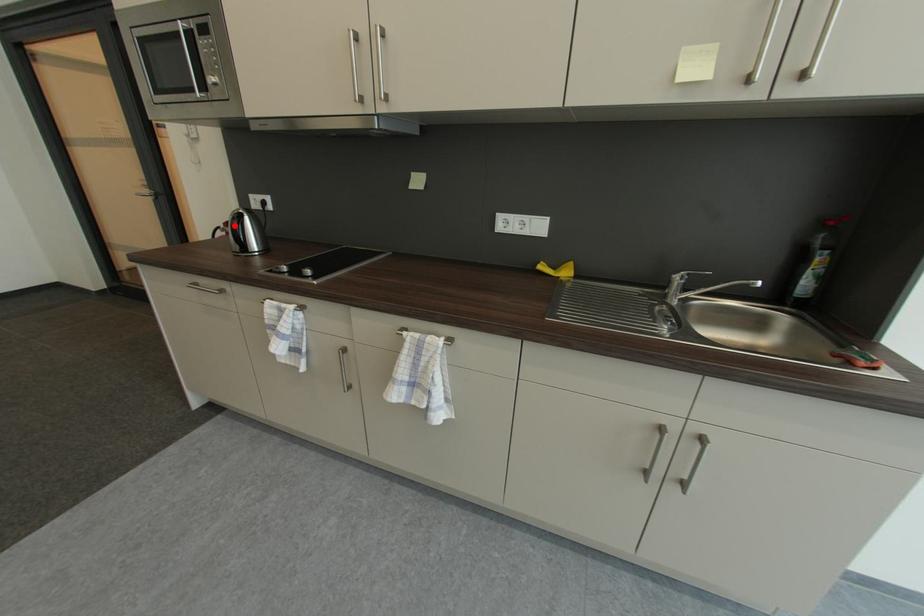
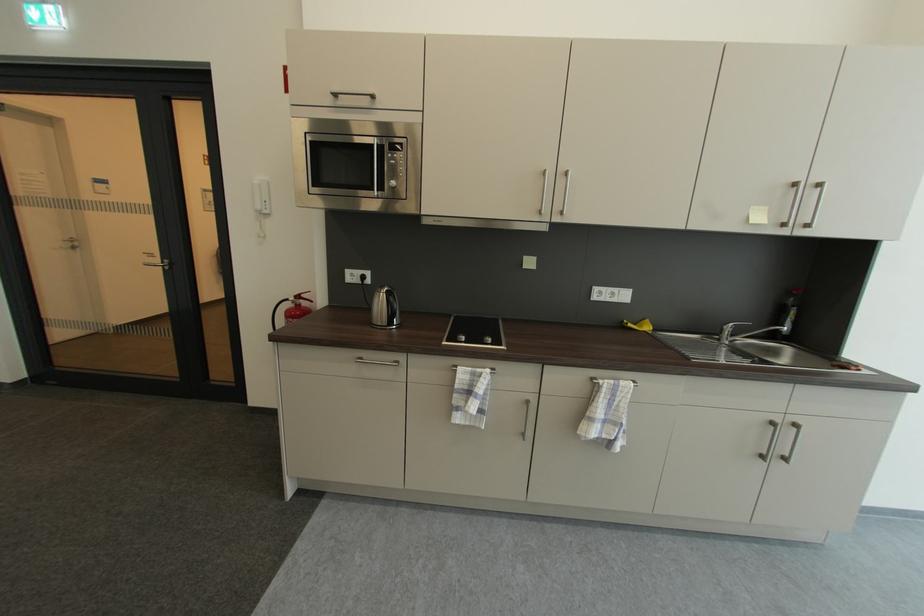
Question: I am providing you with two images of the same scene from different viewpoints. Given a red point in image1, look at the same physical point in image2. Is it:

Choices:
 (A) Closer to the viewpoint
 (B) Farther from the viewpoint

Answer: (A)